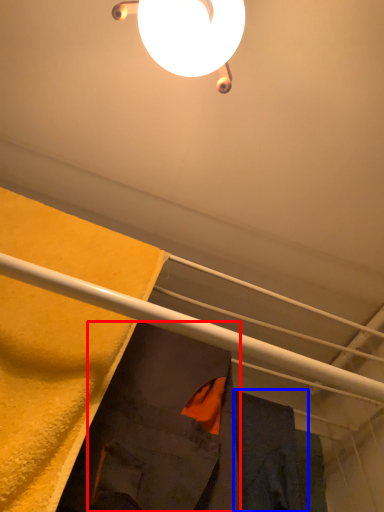
Question: Which point is further to the camera, robe (highlighted by a red box) or robe (highlighted by a blue box)?

Choices:
 (A) robe
 (B) robe

Answer: (B)